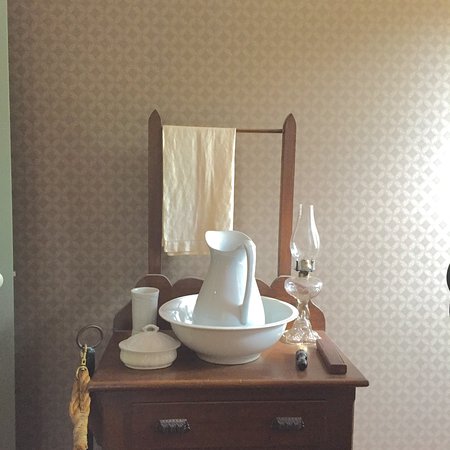
I want to click on drawer, so click(x=244, y=426).